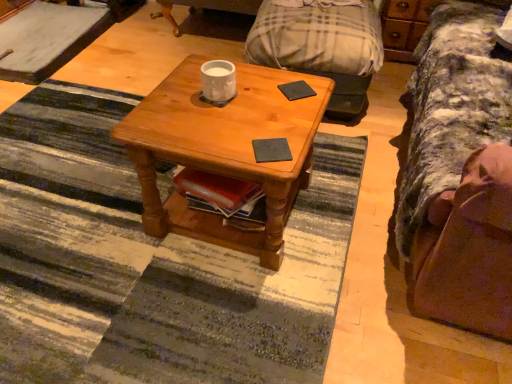
Where is `vacant region to the left of black matte pad at center, the second pad from the bottom`? The image size is (512, 384). vacant region to the left of black matte pad at center, the second pad from the bottom is located at coordinates (256, 90).